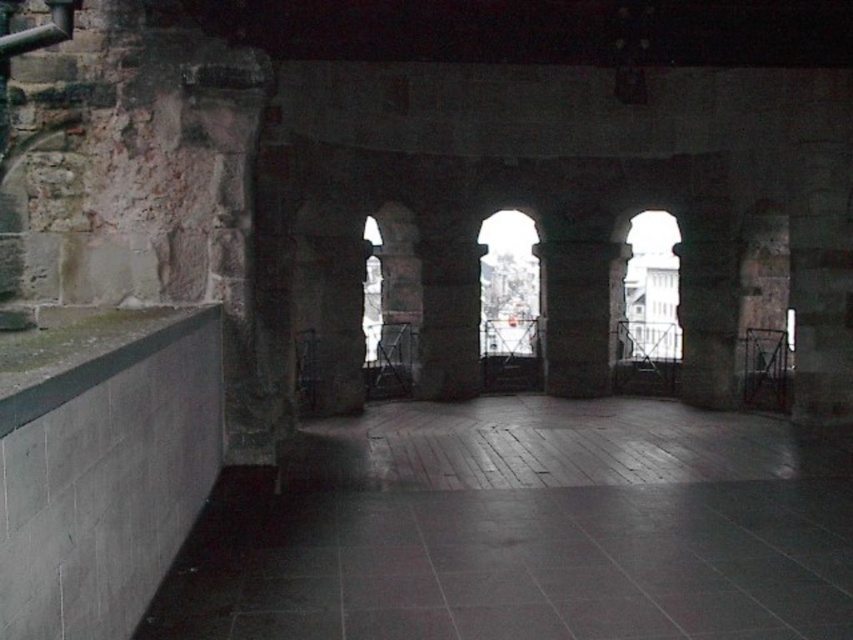
Between dark gray tile floor at lower left and smooth concrete ledge at left, which one has less height?

dark gray tile floor at lower left is shorter.

Is dark gray tile floor at lower left to the right of smooth concrete ledge at left from the viewer's perspective?

Indeed, dark gray tile floor at lower left is positioned on the right side of smooth concrete ledge at left.

Does point (672, 605) come farther from viewer compared to point (32, 374)?

Yes.

The width and height of the screenshot is (853, 640). Identify the location of dark gray tile floor at lower left. (526, 529).

Which of these two, dark gray tile floor at lower left or smooth stone pillar at center, stands taller?

Standing taller between the two is smooth stone pillar at center.

Identify the location of dark gray tile floor at lower left. The width and height of the screenshot is (853, 640). (526, 529).

In order to click on dark gray tile floor at lower left in this screenshot , I will do `click(526, 529)`.

Consider the image. Who is more forward, (107, 326) or (590, 317)?

Positioned in front is point (107, 326).

Which is in front, point (126, 360) or point (553, 262)?

Point (126, 360)

Where is `smooth concrete ledge at left`? smooth concrete ledge at left is located at coordinates pyautogui.click(x=85, y=356).